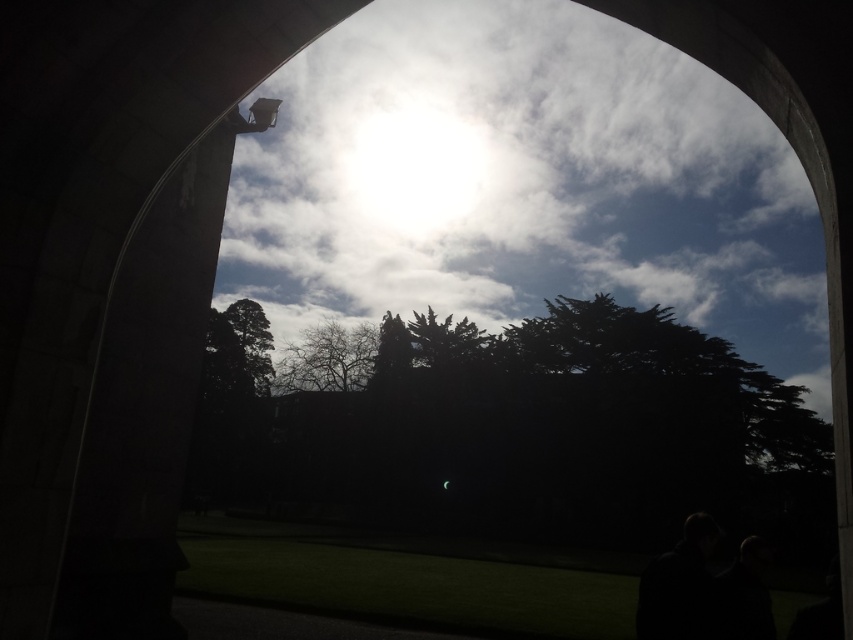
You are standing in front of the arched opening and want to place a small decoration between the two points marked as point (x=265, y=440) and point (x=312, y=356). Which point should the decoration be closer to in order to appear closer to you?

The decoration should be closer to point (x=265, y=440) because it is further to the camera than point (x=312, y=356), making it visually nearer to your position.

You are standing outside the arched opening and want to know which object is closer to you between the green leafy tree at center and the bare branches at center. Based on the scene description, can you determine which one is closer?

The green leafy tree at center is positioned under the bare branches at center, so the bare branches at center are closer to you than the green leafy tree at center.

You are standing in front of the arched opening and want to take a photo of the bright sky beyond. The camera you are using has a depth of field that can focus up to 60 meters. Will the point at coordinates point (788,468) be in focus?

The distance between point (788,468) and the camera is 59.83 meters, which is within the camera depth of field limit of 60 meters. Therefore, the point at coordinates point (788,468) will be in focus.